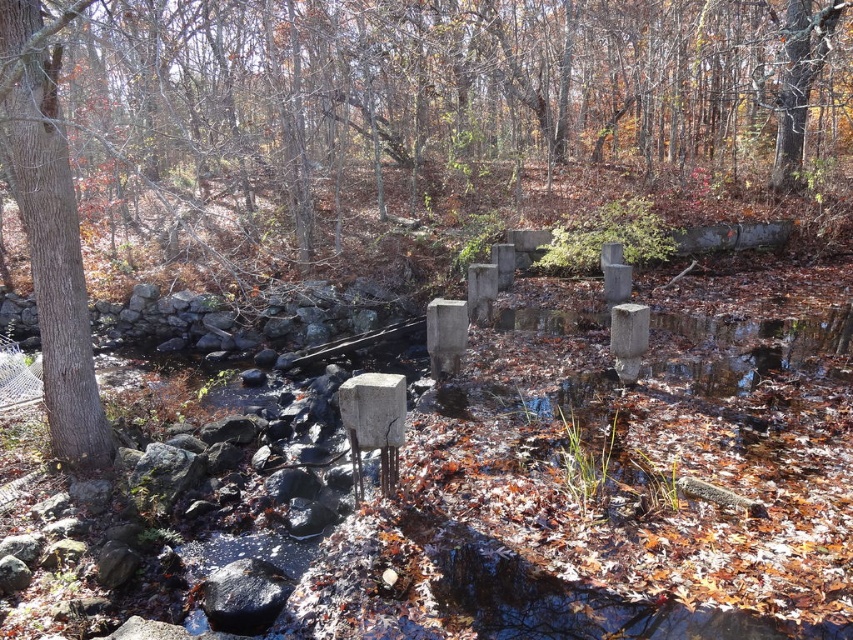
You are standing at the edge of the stream and want to take a photo of the brown rough tree at left. If your camera has a maximum focus range of 4 meters, will you need to move closer to the tree to capture it clearly?

The brown rough tree at left is 4.10 meters away from the camera. Since the camera can only focus up to 4 meters, you need to move closer to ensure the tree is in focus.

You are standing at the edge of the stream and want to cross to the other side. You see a brown rough tree at left and a black smooth rock at lower left. Which object is closer to you as you stand there?

The black smooth rock at lower left is behind the brown rough tree at left, so the brown rough tree at left is closer to you.